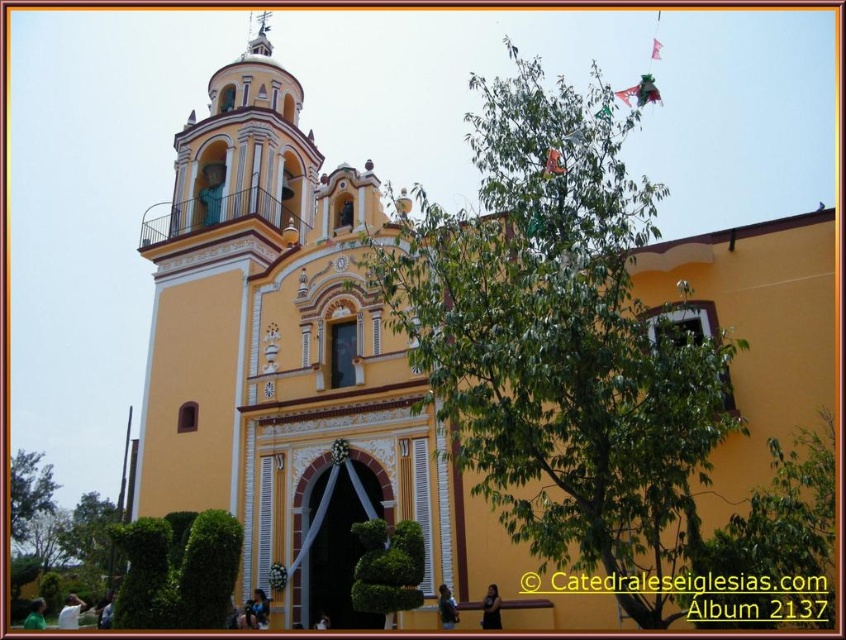
You are standing in front of the yellow church and want to take a photo of the bell tower. There is a point marked at coordinates point (29, 492) which is a green leafy tree at lower left. To avoid the tree blocking the view, should you move to your left or right?

The point (29, 492) marks a green leafy tree at lower left. To avoid the tree blocking the view of the bell tower, you should move to your right.

You are standing in front of the church and notice the green leafy tree at lower left and the smooth white spire at upper center. Which object is taller?

The smooth white spire at upper center is taller than the green leafy tree at lower left.